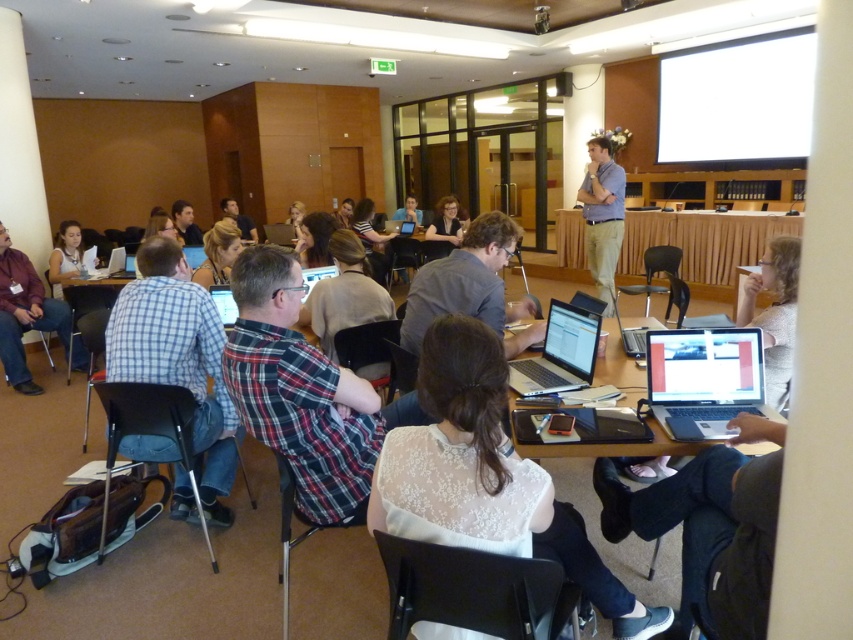
Can you confirm if matte black shirt at left is taller than silver metallic laptop at center?

Yes, matte black shirt at left is taller than silver metallic laptop at center.

Is matte black shirt at left shorter than silver metallic laptop at center?

No.

Where is `matte black shirt at left`? matte black shirt at left is located at coordinates (28, 316).

Between light blue shirt at center and silver metallic laptop at center, which one appears on the right side from the viewer's perspective?

From the viewer's perspective, light blue shirt at center appears more on the right side.

Does light blue shirt at center have a greater width compared to silver metallic laptop at center?

Yes.

Looking at this image, who is more forward, (x=610, y=170) or (x=651, y=324)?

Point (x=651, y=324) is in front.

Identify the location of light blue shirt at center. This screenshot has height=640, width=853. tap(602, 216).

Does point (426, 524) lie behind point (61, 326)?

No, (426, 524) is in front of (61, 326).

Is white lace blouse at center positioned behind matte black shirt at left?

No, it is not.

Describe the element at coordinates (485, 476) in the screenshot. I see `white lace blouse at center` at that location.

This screenshot has width=853, height=640. In order to click on white lace blouse at center in this screenshot , I will do `click(485, 476)`.